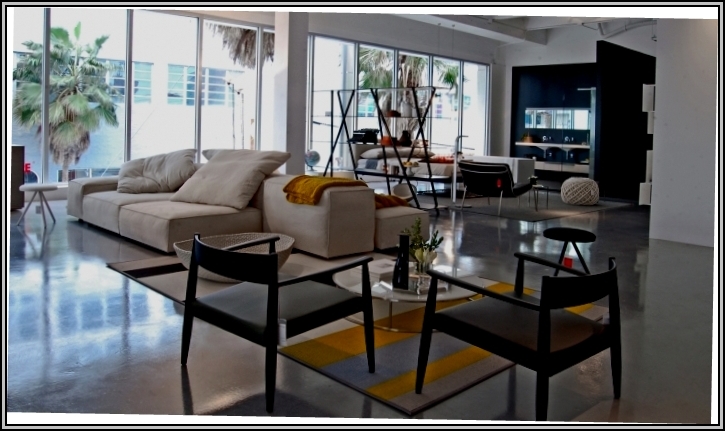
Identify the location of tables. Image resolution: width=725 pixels, height=431 pixels. (32, 186), (389, 297), (573, 235).